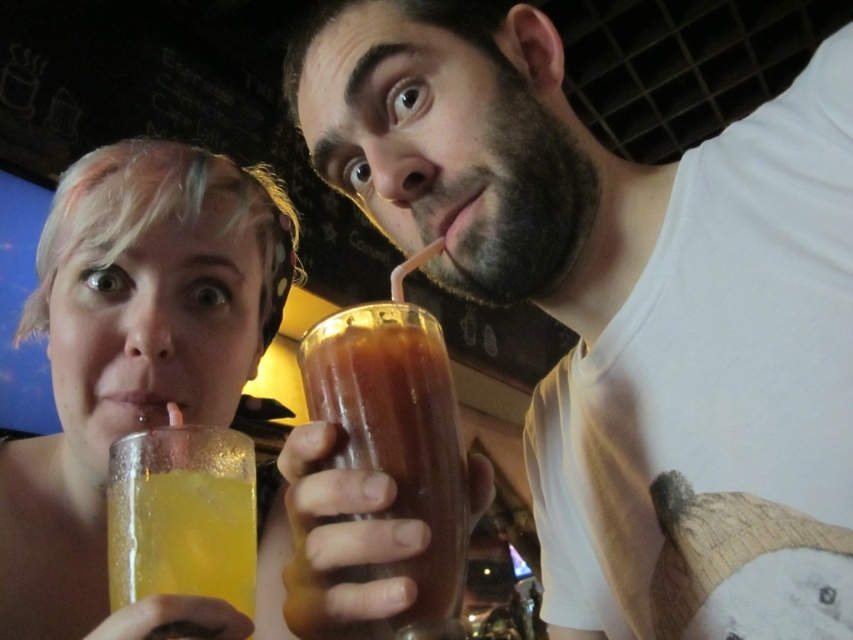
Who is shorter, matte plastic cup at upper center or translucent yellow liquid at lower left?

With less height is translucent yellow liquid at lower left.

Who is more forward, (695, 540) or (213, 515)?

Point (213, 515) is more forward.

Is point (848, 492) behind point (149, 547)?

Yes, it is.

Find the location of a particular element. The image size is (853, 640). matte plastic cup at upper center is located at coordinates (627, 308).

Does translucent glass beverage at center appear over translucent yellow liquid at lower left?

Correct, translucent glass beverage at center is located above translucent yellow liquid at lower left.

In the scene shown: Is translucent glass beverage at center to the right of translucent yellow liquid at lower left from the viewer's perspective?

Correct, you'll find translucent glass beverage at center to the right of translucent yellow liquid at lower left.

Between point (410, 336) and point (117, 483), which one is positioned in front?

Point (410, 336) is more forward.

Where is `translucent glass beverage at center`? The height and width of the screenshot is (640, 853). translucent glass beverage at center is located at coordinates (398, 444).

Who is positioned more to the right, translucent glass at upper left or translucent yellow liquid at lower left?

translucent yellow liquid at lower left

Is translucent glass at upper left bigger than translucent yellow liquid at lower left?

Correct, translucent glass at upper left is larger in size than translucent yellow liquid at lower left.

Between point (33, 445) and point (164, 518), which one is positioned behind?

Positioned behind is point (33, 445).

Locate an element on the screen. The height and width of the screenshot is (640, 853). translucent glass at upper left is located at coordinates (132, 348).